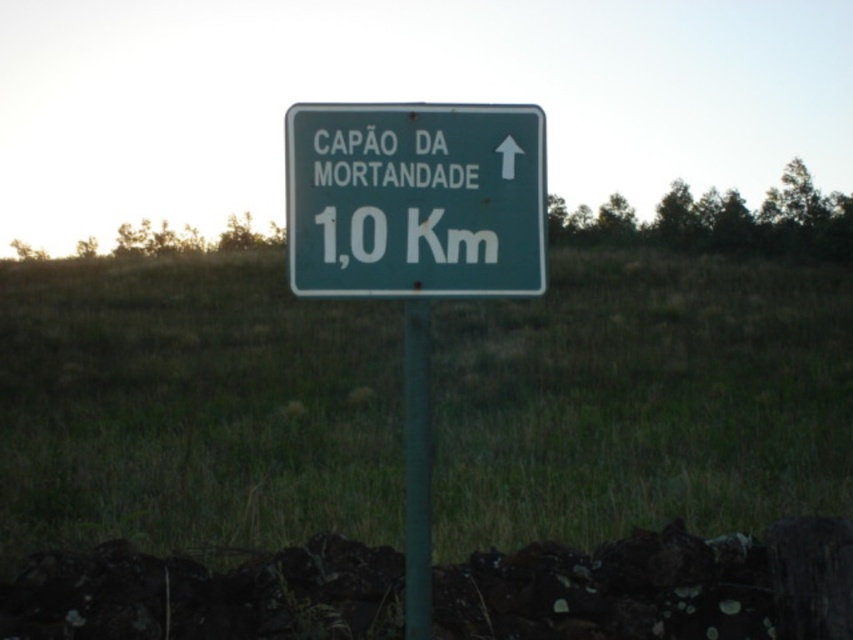
Question: Considering the relative positions of green grass at center and green metallic pole at center in the image provided, where is green grass at center located with respect to green metallic pole at center?

Choices:
 (A) right
 (B) left

Answer: (B)

Question: Which object appears farthest from the camera in this image?

Choices:
 (A) green grass at center
 (B) green metallic pole at center
 (C) green matte signpost at center

Answer: (B)

Question: Which is nearer to the green matte signpost at center?

Choices:
 (A) green metallic pole at center
 (B) green grass at center

Answer: (A)

Question: In this image, where is green grass at center located relative to green matte signpost at center?

Choices:
 (A) below
 (B) above

Answer: (A)

Question: Does green grass at center lie behind green matte signpost at center?

Choices:
 (A) yes
 (B) no

Answer: (B)

Question: Which of the following is the closest to the observer?

Choices:
 (A) green metallic pole at center
 (B) green grass at center

Answer: (B)